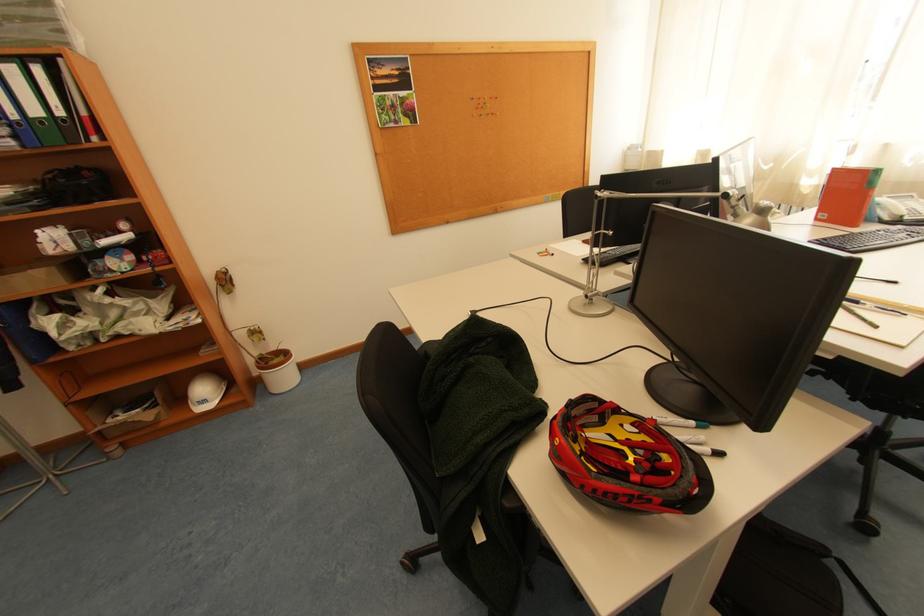
The image size is (924, 616). I want to click on chair armrest, so click(x=480, y=501).